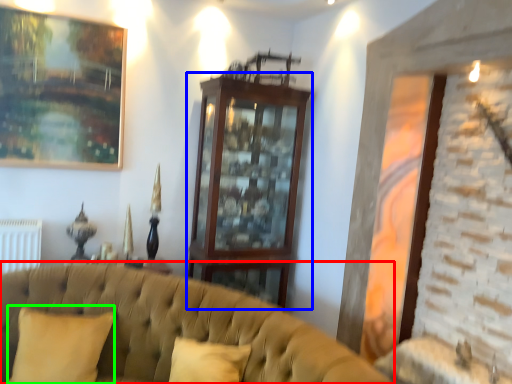
Question: Based on their relative distances, which object is nearer to studio couch (highlighted by a red box)? Choose from dresser (highlighted by a blue box) and pillow (highlighted by a green box).

Choices:
 (A) dresser
 (B) pillow

Answer: (B)